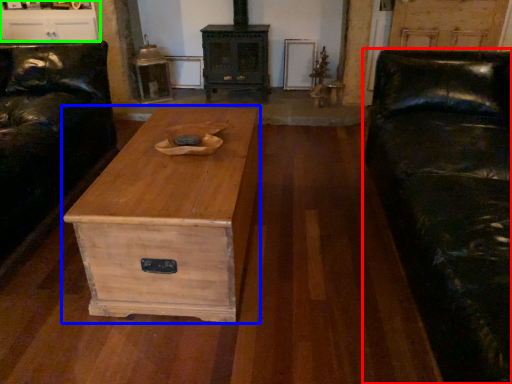
Question: Considering the real-world distances, which object is farthest from studio couch (highlighted by a red box)? chest of drawers (highlighted by a blue box) or entertainment center (highlighted by a green box)?

Choices:
 (A) chest of drawers
 (B) entertainment center

Answer: (B)